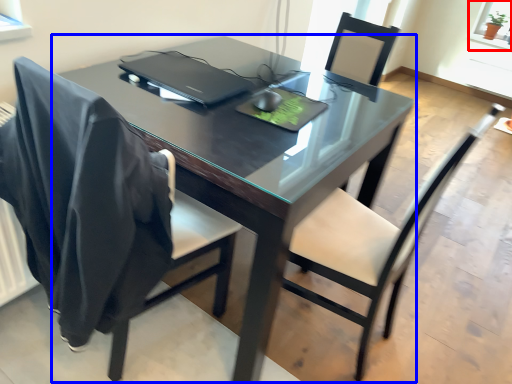
Question: Which object appears closest to the camera in this image, window screen (highlighted by a red box) or table (highlighted by a blue box)?

Choices:
 (A) window screen
 (B) table

Answer: (B)